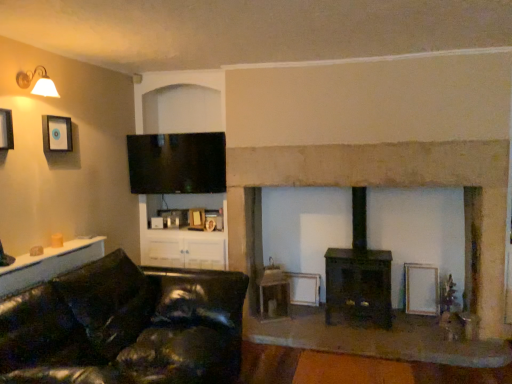
This screenshot has height=384, width=512. In order to click on vacant area to the right of wooden table at center in this screenshot , I will do `click(300, 323)`.